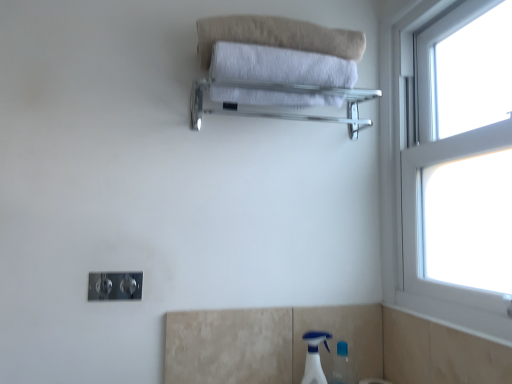
Locate an element on the screen. The image size is (512, 384). white plastic spray bottle at lower right is located at coordinates (314, 357).

Identify the location of white soft towel at upper center. (279, 66).

This screenshot has width=512, height=384. I want to click on white plastic window at right, so click(x=420, y=186).

Locate an element on the screen. This screenshot has height=384, width=512. white plastic spray bottle at lower right is located at coordinates click(314, 357).

In the scene shown: Which object is thinner, white soft towel at upper center or beige cotton towel at upper center?

Thinner between the two is white soft towel at upper center.

Which of these two, white soft towel at upper center or beige cotton towel at upper center, stands shorter?

beige cotton towel at upper center.

Does point (231, 99) come behind point (211, 48)?

That is True.

Based on their positions, is white soft towel at upper center located to the left or right of beige cotton towel at upper center?

white soft towel at upper center is to the right of beige cotton towel at upper center.

From the image's perspective, is white plastic spray bottle at lower right located beneath white soft towel at upper center?

Indeed, from the image's perspective, white plastic spray bottle at lower right is shown beneath white soft towel at upper center.

Can you see white plastic spray bottle at lower right touching white soft towel at upper center?

No, white plastic spray bottle at lower right is not in contact with white soft towel at upper center.

Is white plastic spray bottle at lower right situated inside white soft towel at upper center or outside?

white plastic spray bottle at lower right lies outside white soft towel at upper center.

Does point (312, 374) come in front of point (329, 71)?

No, it is not.

Between point (261, 33) and point (225, 84), which one is positioned in front?

The point (261, 33) is more forward.

Is beige cotton towel at upper center touching clear glass towel rack at upper center?

No, beige cotton towel at upper center is not making contact with clear glass towel rack at upper center.

Consider the image. From a real-world perspective, is beige cotton towel at upper center on clear glass towel rack at upper center?

Correct, in the physical world, beige cotton towel at upper center is higher than clear glass towel rack at upper center.

Does beige cotton towel at upper center have a lesser width compared to clear glass towel rack at upper center?

Indeed, beige cotton towel at upper center has a lesser width compared to clear glass towel rack at upper center.

Considering the sizes of objects clear glass towel rack at upper center and beige cotton towel at upper center in the image provided, who is bigger, clear glass towel rack at upper center or beige cotton towel at upper center?

clear glass towel rack at upper center.

Is clear glass towel rack at upper center next to beige cotton towel at upper center?

No, clear glass towel rack at upper center is not with beige cotton towel at upper center.

Considering the positions of objects clear glass towel rack at upper center and beige cotton towel at upper center in the image provided, who is more to the right, clear glass towel rack at upper center or beige cotton towel at upper center?

From the viewer's perspective, clear glass towel rack at upper center appears more on the right side.

Based on the photo, which object is further away from the camera, clear glass towel rack at upper center or beige cotton towel at upper center?

beige cotton towel at upper center is more distant.

From a real-world perspective, does clear glass towel rack at upper center sit lower than white soft towel at upper center?

Yes, from a real-world perspective, clear glass towel rack at upper center is beneath white soft towel at upper center.

Does clear glass towel rack at upper center turn towards white soft towel at upper center?

No, clear glass towel rack at upper center is not oriented towards white soft towel at upper center.

Considering the sizes of objects clear glass towel rack at upper center and white soft towel at upper center in the image provided, who is thinner, clear glass towel rack at upper center or white soft towel at upper center?

white soft towel at upper center.

Considering the relative sizes of white plastic spray bottle at lower right and beige cotton towel at upper center in the image provided, is white plastic spray bottle at lower right bigger than beige cotton towel at upper center?

No, white plastic spray bottle at lower right is not bigger than beige cotton towel at upper center.

What's the angular difference between white plastic spray bottle at lower right and beige cotton towel at upper center's facing directions?

The angle between the facing direction of white plastic spray bottle at lower right and the facing direction of beige cotton towel at upper center is 0.756 degrees.

Could you tell me if white plastic spray bottle at lower right is facing beige cotton towel at upper center?

No.

Can you confirm if white plastic spray bottle at lower right is shorter than beige cotton towel at upper center?

No, white plastic spray bottle at lower right is not shorter than beige cotton towel at upper center.

Where is `balustrade above the white plastic spray bottle at lower right (from a real-world perspective)`? balustrade above the white plastic spray bottle at lower right (from a real-world perspective) is located at coordinates (284, 113).

From a real-world perspective, is clear glass towel rack at upper center above or below white plastic spray bottle at lower right?

Clearly, from a real-world perspective, clear glass towel rack at upper center is above white plastic spray bottle at lower right.

Does clear glass towel rack at upper center appear on the left side of white plastic spray bottle at lower right?

Yes, clear glass towel rack at upper center is to the left of white plastic spray bottle at lower right.

Could you tell me if clear glass towel rack at upper center is turned towards white plastic spray bottle at lower right?

No, clear glass towel rack at upper center is not turned towards white plastic spray bottle at lower right.

You are a GUI agent. You are given a task and a screenshot of the screen. Output one action in this format:
    pyautogui.click(x=<x>, y=<y>)
    Task: Click on the bath towel lying behind the white soft towel at upper center
    The image size is (512, 384).
    Given the screenshot: What is the action you would take?
    pyautogui.click(x=277, y=36)

The height and width of the screenshot is (384, 512). I want to click on towel above the white plastic spray bottle at lower right (from the image's perspective), so click(279, 66).

Looking at the image, which one is located further to white soft towel at upper center, beige cotton towel at upper center or white plastic window at right?

white plastic window at right is further to white soft towel at upper center.

From the image, which object appears to be farther from clear glass towel rack at upper center, white soft towel at upper center or white plastic spray bottle at lower right?

white plastic spray bottle at lower right lies further to clear glass towel rack at upper center than the other object.

From the picture: Based on their spatial positions, is white plastic spray bottle at lower right or beige cotton towel at upper center further from white plastic window at right?

Based on the image, white plastic spray bottle at lower right appears to be further to white plastic window at right.

When comparing their distances from white soft towel at upper center, does white plastic spray bottle at lower right or beige cotton towel at upper center seem closer?

Among the two, beige cotton towel at upper center is located nearer to white soft towel at upper center.

From the image, which object appears to be nearer to white plastic spray bottle at lower right, beige cotton towel at upper center or clear glass towel rack at upper center?

Based on the image, clear glass towel rack at upper center appears to be nearer to white plastic spray bottle at lower right.

Looking at the image, which one is located further to clear glass towel rack at upper center, white plastic window at right or white plastic spray bottle at lower right?

Among the two, white plastic spray bottle at lower right is located further to clear glass towel rack at upper center.

Estimate the real-world distances between objects in this image. Which object is closer to white soft towel at upper center, white plastic spray bottle at lower right or white plastic window at right?

Based on the image, white plastic window at right appears to be nearer to white soft towel at upper center.

Looking at the image, which one is located further to white plastic spray bottle at lower right, white plastic window at right or white soft towel at upper center?

white soft towel at upper center is further to white plastic spray bottle at lower right.

Locate an element on the screen. This screenshot has width=512, height=384. window between beige cotton towel at upper center and white plastic spray bottle at lower right vertically is located at coordinates (420, 186).

Identify the location of balustrade between beige cotton towel at upper center and white plastic spray bottle at lower right in the up-down direction. The width and height of the screenshot is (512, 384). (284, 113).

You are a GUI agent. You are given a task and a screenshot of the screen. Output one action in this format:
    pyautogui.click(x=<x>, y=<y>)
    Task: Click on the towel between beige cotton towel at upper center and white plastic window at right in the horizontal direction
    Image resolution: width=512 pixels, height=384 pixels.
    Given the screenshot: What is the action you would take?
    pyautogui.click(x=279, y=66)

Image resolution: width=512 pixels, height=384 pixels. I want to click on towel between beige cotton towel at upper center and clear glass towel rack at upper center from top to bottom, so click(x=279, y=66).